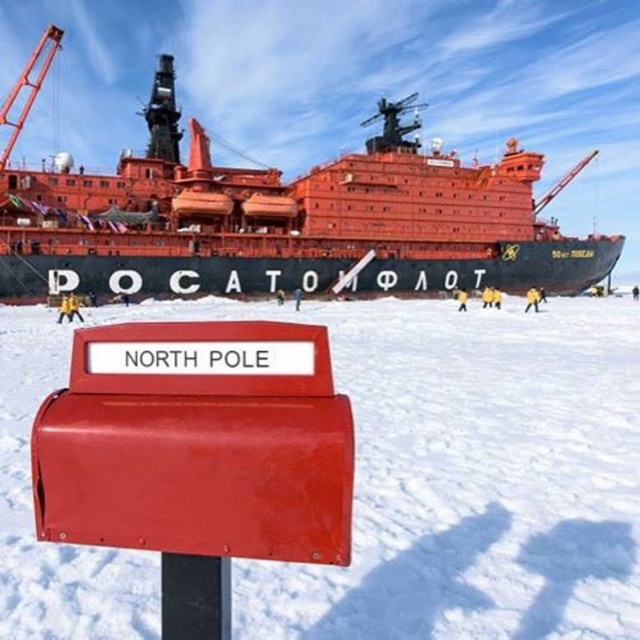
Question: Does white matte snow at center appear on the right side of metallic red crane at upper left?

Choices:
 (A) yes
 (B) no

Answer: (A)

Question: Which object is closer to the camera taking this photo?

Choices:
 (A) metallic red crane at upper left
 (B) white matte snow at center

Answer: (B)

Question: Does white matte snow at center appear under metallic red crane at upper left?

Choices:
 (A) yes
 (B) no

Answer: (A)

Question: Based on their relative distances, which object is farther from the shiny orange ship at upper center?

Choices:
 (A) white matte snow at center
 (B) metallic red crane at upper left

Answer: (B)

Question: Which of the following is the farthest from the observer?

Choices:
 (A) (484, 259)
 (B) (432, 314)

Answer: (A)

Question: Can you confirm if white matte snow at center is smaller than shiny orange ship at upper center?

Choices:
 (A) no
 (B) yes

Answer: (B)